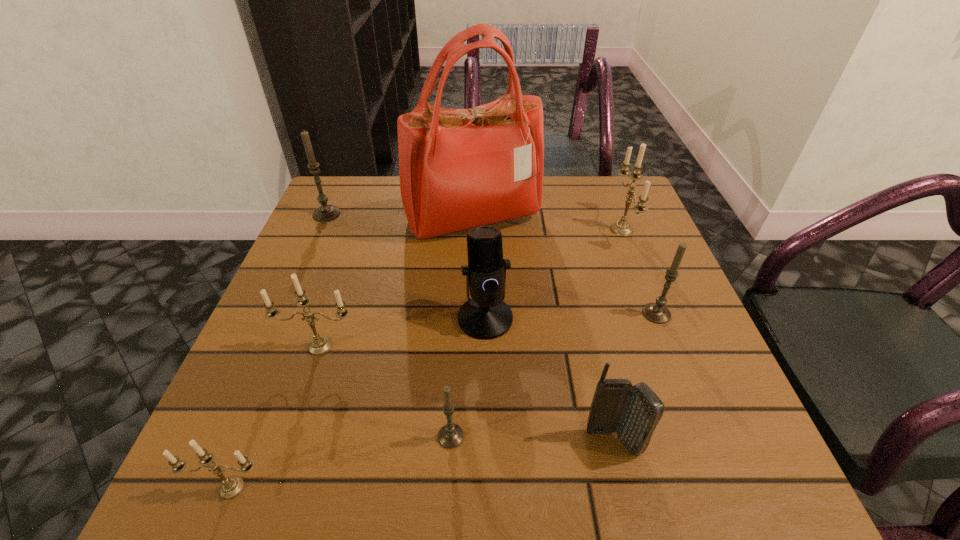
Identify the location of free space at the left edge of the desktop. The image size is (960, 540). (295, 255).

The image size is (960, 540). In the image, there is a desktop. Find the location of `free region at the right edge`. free region at the right edge is located at coordinates (643, 255).

This screenshot has height=540, width=960. In the image, there is a desktop. What are the coordinates of `vacant space at the far left corner` in the screenshot? It's located at (340, 219).

Locate an element on the screen. This screenshot has height=540, width=960. vacant space at the near left corner of the desktop is located at coordinates (244, 454).

Identify the location of free location at the far right corner. The image size is (960, 540). (596, 215).

What are the coordinates of `vacant region at the near right corner of the desktop` in the screenshot? It's located at (650, 447).

Locate an element on the screen. The width and height of the screenshot is (960, 540). vacant area that lies between the cellular telephone and the third farthest candle is located at coordinates (635, 378).

At what (x,y) coordinates should I click in order to perform the action: click on free space between the nearest object and the third object from right to left. Please return your answer as a coordinate pair (x, y). This screenshot has height=540, width=960. Looking at the image, I should click on (422, 465).

What are the coordinates of `free space between the seventh object from left to right and the third farthest candle` in the screenshot? It's located at (635, 378).

This screenshot has height=540, width=960. What are the coordinates of `free space that is in between the farthest metallic candle and the second nearest gray candle` in the screenshot? It's located at (639, 272).